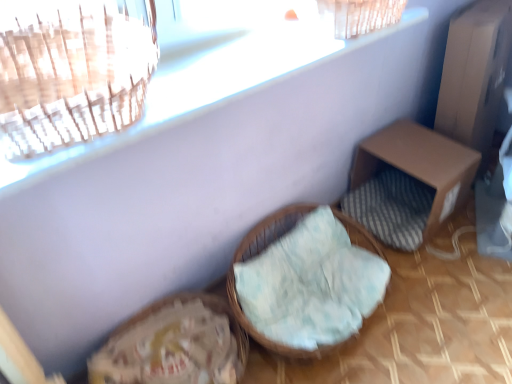
This screenshot has width=512, height=384. Find the location of `brown cardboard box at right, the 1th furniture from the right`. brown cardboard box at right, the 1th furniture from the right is located at coordinates (408, 183).

Describe the element at coordinates (408, 183) in the screenshot. I see `brown cardboard box at right, the second furniture from the left` at that location.

This screenshot has height=384, width=512. Describe the element at coordinates (306, 281) in the screenshot. I see `woven wicker basket at center, the 1th furniture in the left-to-right sequence` at that location.

Locate an element on the screen. woven wicker basket at center, which is counted as the second furniture, starting from the right is located at coordinates 306,281.

Image resolution: width=512 pixels, height=384 pixels. I want to click on brown cardboard box at right, the second furniture from the left, so click(408, 183).

Which object is positioned more to the left, brown cardboard box at right, the second furniture from the left, or woven wicker basket at center, the 1th furniture in the left-to-right sequence?

woven wicker basket at center, the 1th furniture in the left-to-right sequence, is more to the left.

Relative to woven wicker basket at center, which is counted as the second furniture, starting from the right, is brown cardboard box at right, the 1th furniture from the right, in front or behind?

Visually, brown cardboard box at right, the 1th furniture from the right, is located behind woven wicker basket at center, which is counted as the second furniture, starting from the right.

Is point (429, 230) behind point (290, 218)?

Yes.

From the image's perspective, is brown cardboard box at right, the second furniture from the left, under woven wicker basket at center, the 1th furniture in the left-to-right sequence?

No, from the image's perspective, brown cardboard box at right, the second furniture from the left, is not below woven wicker basket at center, the 1th furniture in the left-to-right sequence.

From a real-world perspective, which object rests below the other?

woven wicker basket at center, the 1th furniture in the left-to-right sequence, from a real-world perspective.

Is brown cardboard box at right, the 1th furniture from the right, wider or thinner than woven wicker basket at center, which is counted as the second furniture, starting from the right?

Considering their sizes, brown cardboard box at right, the 1th furniture from the right, looks slimmer than woven wicker basket at center, which is counted as the second furniture, starting from the right.

Between brown cardboard box at right, the 1th furniture from the right, and woven wicker basket at center, the 1th furniture in the left-to-right sequence, which one has more height?

With more height is brown cardboard box at right, the 1th furniture from the right.

Considering the relative sizes of brown cardboard box at right, the 1th furniture from the right, and woven wicker basket at center, the 1th furniture in the left-to-right sequence, in the image provided, is brown cardboard box at right, the 1th furniture from the right, smaller than woven wicker basket at center, the 1th furniture in the left-to-right sequence,?

Actually, brown cardboard box at right, the 1th furniture from the right, might be larger than woven wicker basket at center, the 1th furniture in the left-to-right sequence.

Is brown cardboard box at right, the 1th furniture from the right, inside the boundaries of woven wicker basket at center, the 1th furniture in the left-to-right sequence, or outside?

The correct answer is: outside.

Is brown cardboard box at right, the second furniture from the left, touching woven wicker basket at center, the 1th furniture in the left-to-right sequence?

No, brown cardboard box at right, the second furniture from the left, is not in contact with woven wicker basket at center, the 1th furniture in the left-to-right sequence.

From the picture: Is brown cardboard box at right, the second furniture from the left, oriented away from woven wicker basket at center, which is counted as the second furniture, starting from the right?

brown cardboard box at right, the second furniture from the left, does not have its back to woven wicker basket at center, which is counted as the second furniture, starting from the right.

At what (x,y) coordinates should I click in order to perform the action: click on furniture below the brown cardboard box at right, the 1th furniture from the right (from a real-world perspective). Please return your answer as a coordinate pair (x, y). This screenshot has width=512, height=384. Looking at the image, I should click on (306, 281).

Based on their positions, is woven wicker basket at center, which is counted as the second furniture, starting from the right, located to the left or right of brown cardboard box at right, the 1th furniture from the right?

In the image, woven wicker basket at center, which is counted as the second furniture, starting from the right, appears on the left side of brown cardboard box at right, the 1th furniture from the right.

Which is in front, woven wicker basket at center, which is counted as the second furniture, starting from the right, or brown cardboard box at right, the 1th furniture from the right?

woven wicker basket at center, which is counted as the second furniture, starting from the right.

Considering the points (231, 295) and (384, 201), which point is behind, point (231, 295) or point (384, 201)?

The point (384, 201) is farther.

In the scene shown: From the image's perspective, is woven wicker basket at center, which is counted as the second furniture, starting from the right, positioned above or below brown cardboard box at right, the second furniture from the left?

woven wicker basket at center, which is counted as the second furniture, starting from the right, is below brown cardboard box at right, the second furniture from the left.

In the scene shown: From a real-world perspective, relative to brown cardboard box at right, the 1th furniture from the right, is woven wicker basket at center, the 1th furniture in the left-to-right sequence, vertically above or below?

woven wicker basket at center, the 1th furniture in the left-to-right sequence, is below brown cardboard box at right, the 1th furniture from the right.

Looking at their sizes, would you say woven wicker basket at center, the 1th furniture in the left-to-right sequence, is wider or thinner than brown cardboard box at right, the 1th furniture from the right?

In the image, woven wicker basket at center, the 1th furniture in the left-to-right sequence, appears to be wider than brown cardboard box at right, the 1th furniture from the right.

Which of these two, woven wicker basket at center, the 1th furniture in the left-to-right sequence, or brown cardboard box at right, the 1th furniture from the right, stands taller?

brown cardboard box at right, the 1th furniture from the right, is taller.

Consider the image. Is woven wicker basket at center, which is counted as the second furniture, starting from the right, smaller than brown cardboard box at right, the 1th furniture from the right?

Yes.

Is woven wicker basket at center, which is counted as the second furniture, starting from the right, surrounding brown cardboard box at right, the 1th furniture from the right?

Definitely not — brown cardboard box at right, the 1th furniture from the right, is not inside woven wicker basket at center, which is counted as the second furniture, starting from the right.

Looking at this image, is woven wicker basket at center, the 1th furniture in the left-to-right sequence, beside brown cardboard box at right, the second furniture from the left?

No, woven wicker basket at center, the 1th furniture in the left-to-right sequence, is not with brown cardboard box at right, the second furniture from the left.

From the picture: Is woven wicker basket at center, which is counted as the second furniture, starting from the right, looking in the opposite direction of brown cardboard box at right, the second furniture from the left?

No, brown cardboard box at right, the second furniture from the left, is not at the back of woven wicker basket at center, which is counted as the second furniture, starting from the right.

Identify the location of furniture behind the woven wicker basket at center, the 1th furniture in the left-to-right sequence. (408, 183).

You are a GUI agent. You are given a task and a screenshot of the screen. Output one action in this format:
    pyautogui.click(x=<x>, y=<y>)
    Task: Click on the furniture to the right of woven wicker basket at center, the 1th furniture in the left-to-right sequence
    
    Given the screenshot: What is the action you would take?
    pyautogui.click(x=408, y=183)

This screenshot has height=384, width=512. I want to click on furniture that appears above the woven wicker basket at center, which is counted as the second furniture, starting from the right (from a real-world perspective), so click(408, 183).